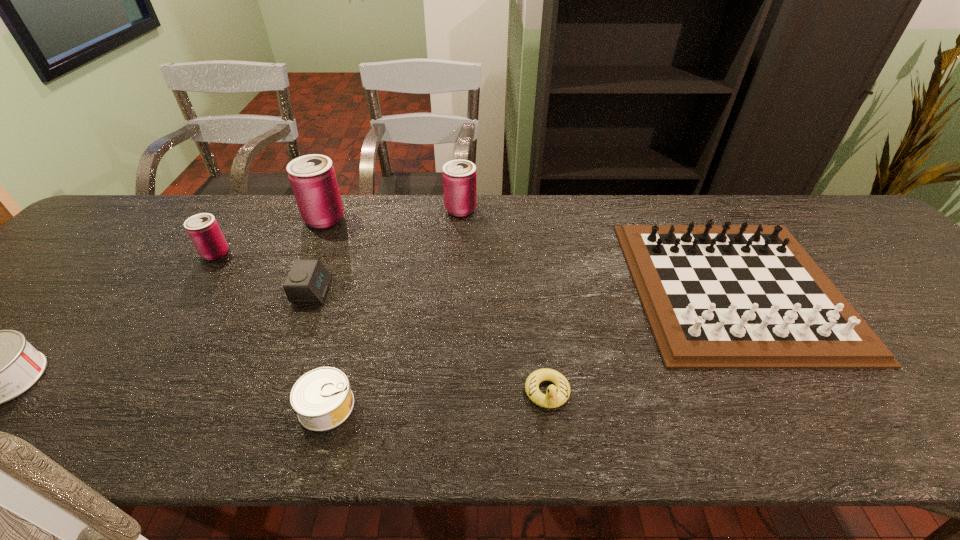
At what (x,y) coordinates should I click in order to perform the action: click on the seventh object from left to right. Please return your answer as a coordinate pair (x, y). Looking at the image, I should click on coord(556,396).

What are the coordinates of `the shortest can` in the screenshot? It's located at (322, 398).

At what (x,y) coordinates should I click in order to perform the action: click on the second can from right to left. Please return your answer as a coordinate pair (x, y). The width and height of the screenshot is (960, 540). Looking at the image, I should click on (322, 398).

At what (x,y) coordinates should I click in order to perform the action: click on vacant space located on the right of the tallest can. Please return your answer as a coordinate pair (x, y). This screenshot has width=960, height=540. Looking at the image, I should click on (406, 219).

Image resolution: width=960 pixels, height=540 pixels. What are the coordinates of `vacant space located 0.160m on the right of the fourth shortest can` in the screenshot? It's located at (529, 210).

This screenshot has width=960, height=540. I want to click on vacant area situated 0.140m on the left of the nearest pink can, so click(x=151, y=253).

Identify the location of free location located on the left of the black gameboard. (503, 287).

You are a GUI agent. You are given a task and a screenshot of the screen. Output one action in this format:
    pyautogui.click(x=<x>, y=<y>)
    Task: Click on the free spot located on the front-facing side of the black alarm clock
    Image resolution: width=960 pixels, height=540 pixels.
    Given the screenshot: What is the action you would take?
    pyautogui.click(x=356, y=291)

I want to click on blank space located 0.390m on the left of the fourth object from right to left, so click(x=97, y=406).

The height and width of the screenshot is (540, 960). Find the location of `gameboard at the far edge`. gameboard at the far edge is located at coordinates (744, 296).